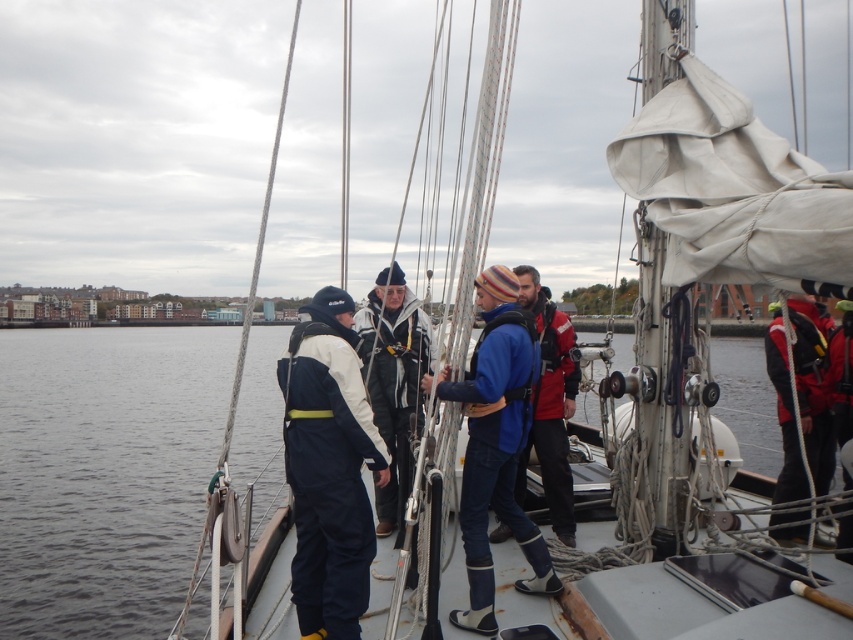
Who is positioned more to the right, transparent water at center or white matte jacket at center?

white matte jacket at center is more to the right.

Can you confirm if transparent water at center is positioned above white matte jacket at center?

No.

Measure the distance between transparent water at center and camera.

transparent water at center and camera are 8.23 meters apart from each other.

You are a GUI agent. You are given a task and a screenshot of the screen. Output one action in this format:
    pyautogui.click(x=<x>, y=<y>)
    Task: Click on the transparent water at center
    This screenshot has width=853, height=640.
    Given the screenshot: What is the action you would take?
    pyautogui.click(x=103, y=468)

Is white matte jacket at center to the right of red life jacket at right from the viewer's perspective?

No, white matte jacket at center is not to the right of red life jacket at right.

How far apart are white matte jacket at center and red life jacket at right?

The distance of white matte jacket at center from red life jacket at right is 3.33 meters.

I want to click on white matte jacket at center, so pyautogui.click(x=393, y=380).

At what (x,y) coordinates should I click in order to perform the action: click on white matte jacket at center. Please return your answer as a coordinate pair (x, y). Looking at the image, I should click on (393, 380).

Which of these two, white matte jacket at center or blue fabric jacket at center, stands taller?

white matte jacket at center

Identify the location of white matte jacket at center. (393, 380).

The height and width of the screenshot is (640, 853). What are the coordinates of `white matte jacket at center` in the screenshot? It's located at (393, 380).